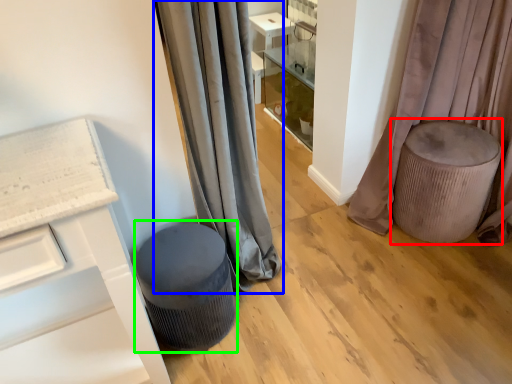
Question: Which is nearer to the swivel chair (highlighted by a red box)? curtain (highlighted by a blue box) or music stool (highlighted by a green box).

Choices:
 (A) curtain
 (B) music stool

Answer: (A)